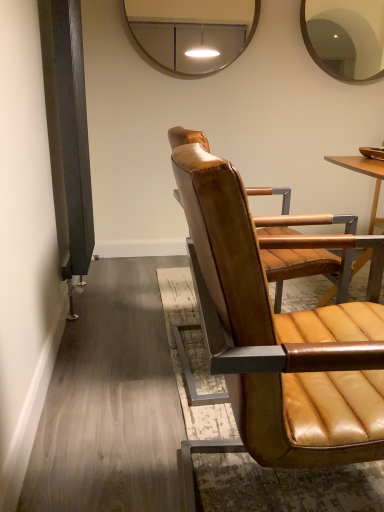
Question: Is matte brown leather chair at center to the right of matte brown mirror at upper right, marked as the first mirror in a right-to-left arrangement, from the viewer's perspective?

Choices:
 (A) no
 (B) yes

Answer: (A)

Question: Is matte brown leather chair at center surrounding matte brown mirror at upper right, the second mirror viewed from the left?

Choices:
 (A) yes
 (B) no

Answer: (B)

Question: Does matte brown leather chair at center have a greater width compared to matte brown mirror at upper right, the second mirror viewed from the left?

Choices:
 (A) yes
 (B) no

Answer: (A)

Question: Is the surface of matte brown leather chair at center in direct contact with matte brown mirror at upper right, the second mirror viewed from the left?

Choices:
 (A) no
 (B) yes

Answer: (A)

Question: Is matte brown leather chair at center in front of matte brown mirror at upper right, the second mirror viewed from the left?

Choices:
 (A) no
 (B) yes

Answer: (B)

Question: Looking at their shapes, would you say matte brown leather chair at center is wider or thinner than metallic silver mirror at upper center, arranged as the second mirror when viewed from the right?

Choices:
 (A) thin
 (B) wide

Answer: (B)

Question: Visually, is matte brown leather chair at center positioned to the left or to the right of metallic silver mirror at upper center, which is the 1th mirror from left to right?

Choices:
 (A) left
 (B) right

Answer: (B)

Question: Relative to metallic silver mirror at upper center, which is the 1th mirror from left to right, is matte brown leather chair at center in front or behind?

Choices:
 (A) front
 (B) behind

Answer: (A)

Question: Would you say matte brown leather chair at center is inside or outside metallic silver mirror at upper center, which is the 1th mirror from left to right?

Choices:
 (A) outside
 (B) inside

Answer: (A)

Question: From a real-world perspective, is metallic silver mirror at upper center, arranged as the second mirror when viewed from the right, above or below matte brown mirror at upper right, the second mirror viewed from the left?

Choices:
 (A) above
 (B) below

Answer: (B)

Question: Is metallic silver mirror at upper center, arranged as the second mirror when viewed from the right, spatially inside matte brown mirror at upper right, the second mirror viewed from the left, or outside of it?

Choices:
 (A) outside
 (B) inside

Answer: (A)

Question: From their relative heights in the image, would you say metallic silver mirror at upper center, arranged as the second mirror when viewed from the right, is taller or shorter than matte brown mirror at upper right, the second mirror viewed from the left?

Choices:
 (A) tall
 (B) short

Answer: (B)

Question: From the image's perspective, relative to matte brown mirror at upper right, marked as the first mirror in a right-to-left arrangement, is metallic silver mirror at upper center, arranged as the second mirror when viewed from the right, above or below?

Choices:
 (A) below
 (B) above

Answer: (A)

Question: From the image's perspective, is matte brown mirror at upper right, marked as the first mirror in a right-to-left arrangement, above or below matte brown leather chair at center?

Choices:
 (A) above
 (B) below

Answer: (A)

Question: Considering the positions of matte brown mirror at upper right, marked as the first mirror in a right-to-left arrangement, and matte brown leather chair at center in the image, is matte brown mirror at upper right, marked as the first mirror in a right-to-left arrangement, wider or thinner than matte brown leather chair at center?

Choices:
 (A) wide
 (B) thin

Answer: (B)